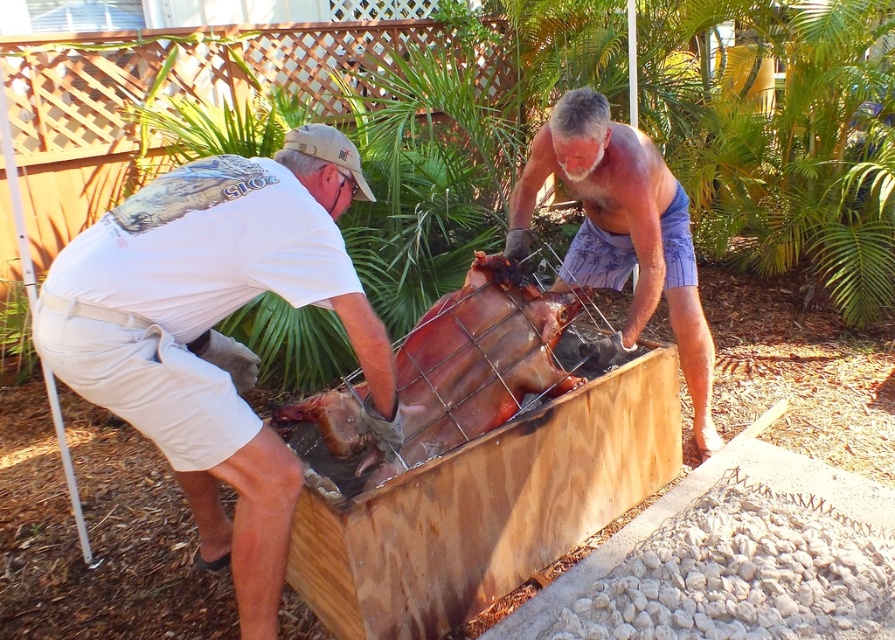
You are a photographer standing 10 feet away from the barbecue scene. You want to capture a photo that includes both the white cotton shirt at left and the beige textured shorts at center. Can you fit both subjects into your camera frame if your lens has a maximum field of view of 8 feet?

The distance between the white cotton shirt at left and the beige textured shorts at center is 4.15 feet. Since your camera lens has a maximum field of view of 8 feet, which is larger than the 4.15 feet separation, you can easily fit both subjects into your camera frame.

Based on the scene, can you determine if the beige textured shorts at center are covering the brown leather skin at center?

Yes, the beige textured shorts at center are positioned over the brown leather skin at center, indicating they are covering it.

You are a photographer trying to capture a closeup of the beige textured shorts at center and the brown leather skin at center. Can you fit both subjects in your camera frame if your camera has a maximum field of view of 50 centimeters?

The beige textured shorts at center and brown leather skin at center are 49.32 centimeters apart, so yes, both subjects can fit within the camera frame since the distance between them is less than the 50 cm maximum field of view.